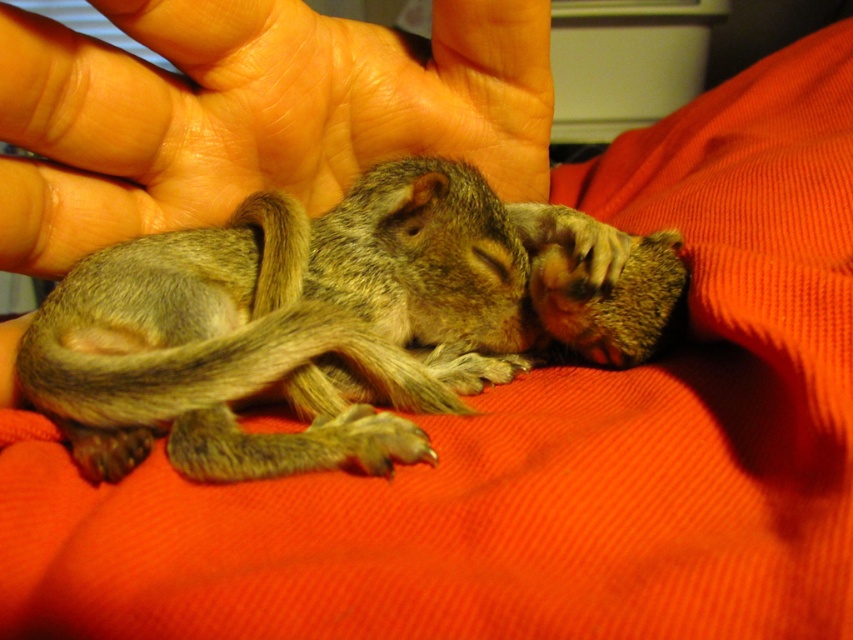
Question: Which object appears farthest from the camera in this image?

Choices:
 (A) flesh-toned skin at center
 (B) soft brown fur squirrel at center

Answer: (A)

Question: Is the position of soft brown fur squirrel at center more distant than that of flesh-toned skin at center?

Choices:
 (A) no
 (B) yes

Answer: (A)

Question: Which of the following is the closest to the observer?

Choices:
 (A) (469, 369)
 (B) (59, 147)

Answer: (B)

Question: Can you confirm if soft brown fur squirrel at center is thinner than flesh-toned skin at center?

Choices:
 (A) no
 (B) yes

Answer: (A)

Question: Does soft brown fur squirrel at center come in front of flesh-toned skin at center?

Choices:
 (A) yes
 (B) no

Answer: (A)